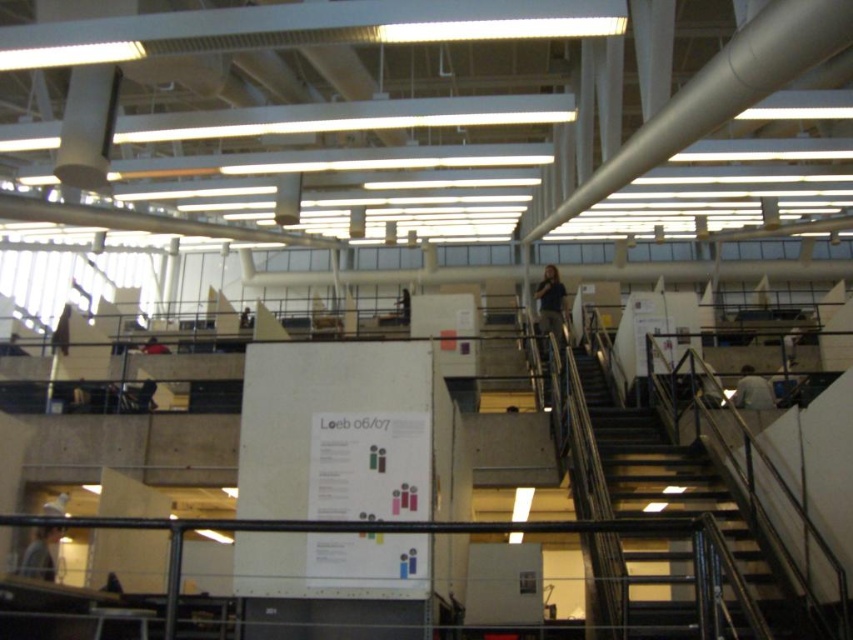
Question: Which point is closer to the camera?

Choices:
 (A) light gray knit hat at lower left
 (B) dark brown leather jacket at upper center
 (C) dark blue shirt at lower left

Answer: (A)

Question: Which point is closer to the camera taking this photo?

Choices:
 (A) (558, 291)
 (B) (32, 545)

Answer: (B)

Question: Which point is farther to the camera?

Choices:
 (A) (764, 384)
 (B) (42, 509)

Answer: (A)

Question: Can you confirm if black metal stairs at lower right is positioned below light brown fabric shirt at lower right?

Choices:
 (A) no
 (B) yes

Answer: (B)

Question: Observing the image, what is the correct spatial positioning of black metal stairs at lower right in reference to dark gray shirt at lower left?

Choices:
 (A) left
 (B) right

Answer: (B)

Question: Considering the relative positions of light gray knit hat at lower left and dark gray shirt at lower left in the image provided, where is light gray knit hat at lower left located with respect to dark gray shirt at lower left?

Choices:
 (A) above
 (B) below

Answer: (B)